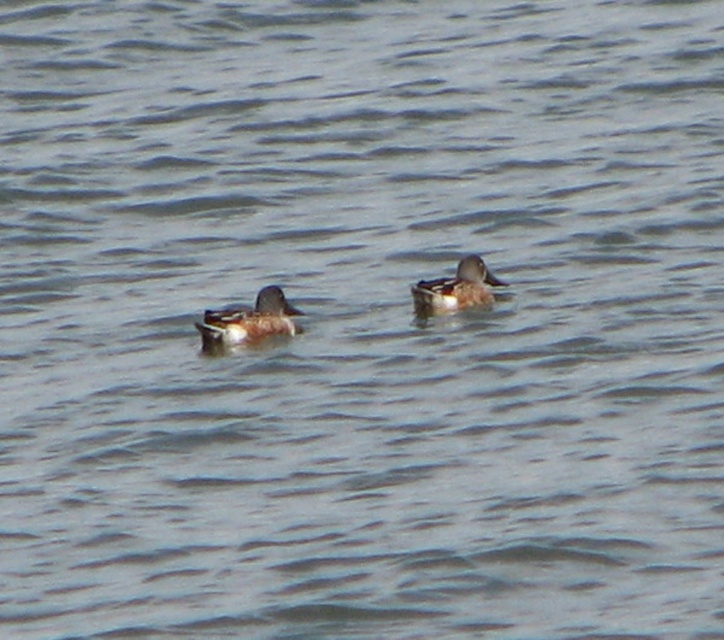
Does brown matte duck at center have a smaller size compared to brown speckled duck at center?

No, brown matte duck at center is not smaller than brown speckled duck at center.

Who is more forward, (272,298) or (484,282)?

Positioned in front is point (272,298).

Find the location of a particular element. brown matte duck at center is located at coordinates (248, 321).